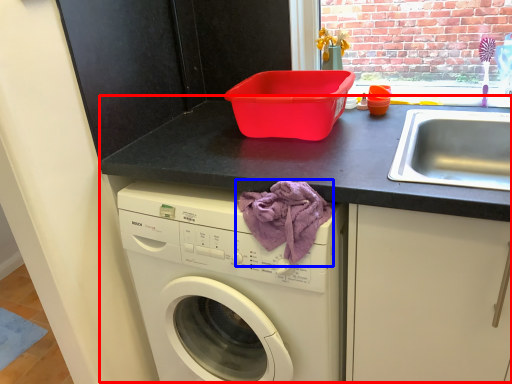
Question: Which object appears farthest to the camera in this image, counter (highlighted by a red box) or blanket (highlighted by a blue box)?

Choices:
 (A) counter
 (B) blanket

Answer: (B)